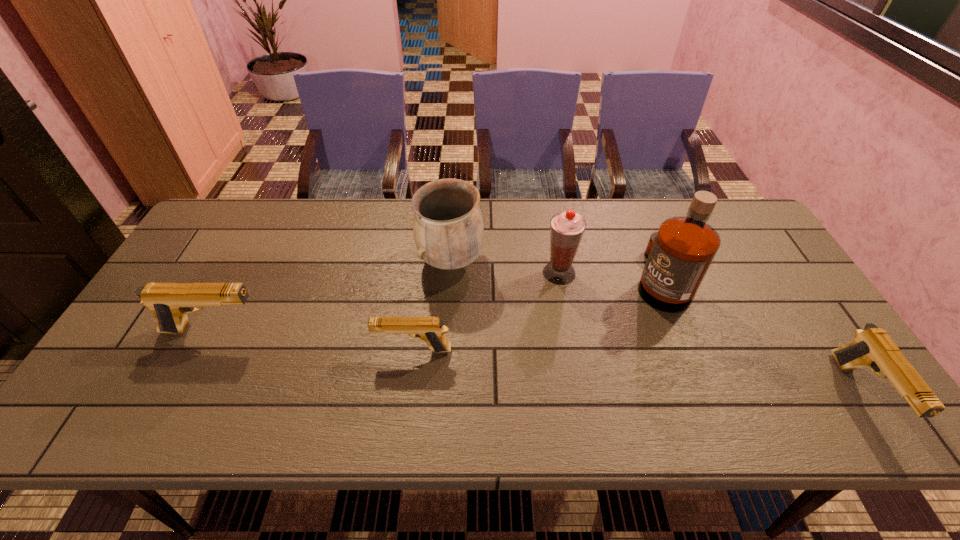
This screenshot has width=960, height=540. What are the coordinates of `object situated at the near edge` in the screenshot? It's located at (872, 347).

The width and height of the screenshot is (960, 540). In order to click on object positioned at the left edge in this screenshot , I will do `click(170, 302)`.

Identify the location of object present at the right edge. Image resolution: width=960 pixels, height=540 pixels. (872, 347).

The image size is (960, 540). Find the location of `object at the near right corner`. object at the near right corner is located at coordinates (872, 347).

Image resolution: width=960 pixels, height=540 pixels. I want to click on vacant region at the far edge of the desktop, so click(x=309, y=238).

The image size is (960, 540). In order to click on free region at the near edge of the desktop in this screenshot , I will do `click(755, 393)`.

I want to click on vacant region at the left edge of the desktop, so click(222, 252).

You are a GUI agent. You are given a task and a screenshot of the screen. Output one action in this format:
    pyautogui.click(x=<x>, y=<y>)
    Task: Click on the free space at the right edge of the desktop
    The image size is (960, 540).
    Given the screenshot: What is the action you would take?
    tap(762, 285)

Find the location of `vacant space at the far left corner of the desktop`. vacant space at the far left corner of the desktop is located at coordinates (219, 231).

In the image, there is a desktop. At what (x,y) coordinates should I click in order to perform the action: click on vacant space at the near right corner. Please return your answer as a coordinate pair (x, y). Image resolution: width=960 pixels, height=540 pixels. Looking at the image, I should click on (866, 389).